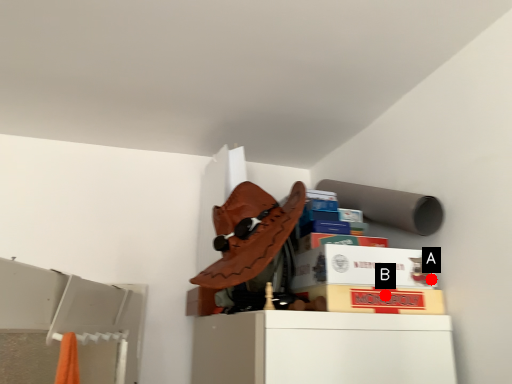
Question: Two points are circled on the image, labeled by A and B beside each circle. Which point is farther to the camera?

Choices:
 (A) A is further
 (B) B is further

Answer: (A)